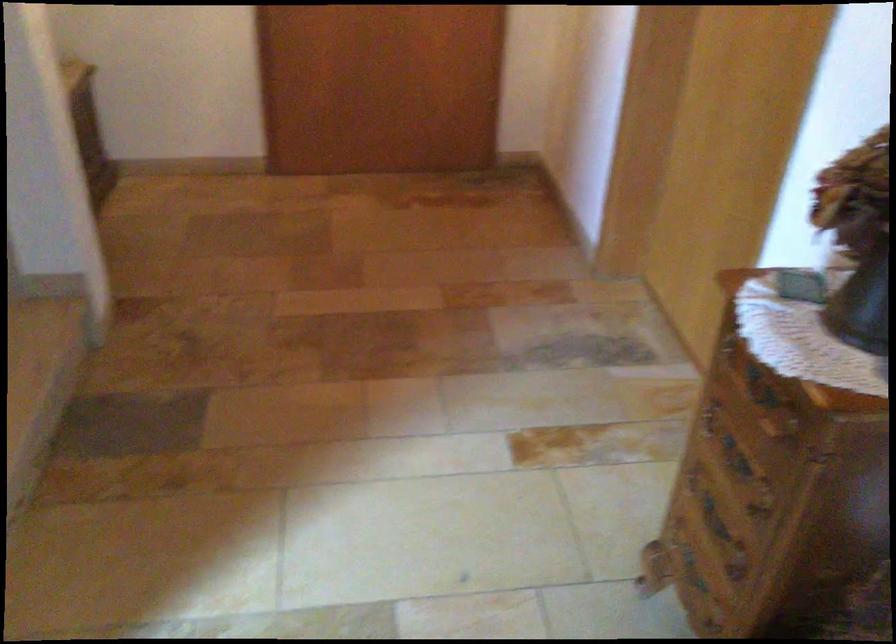
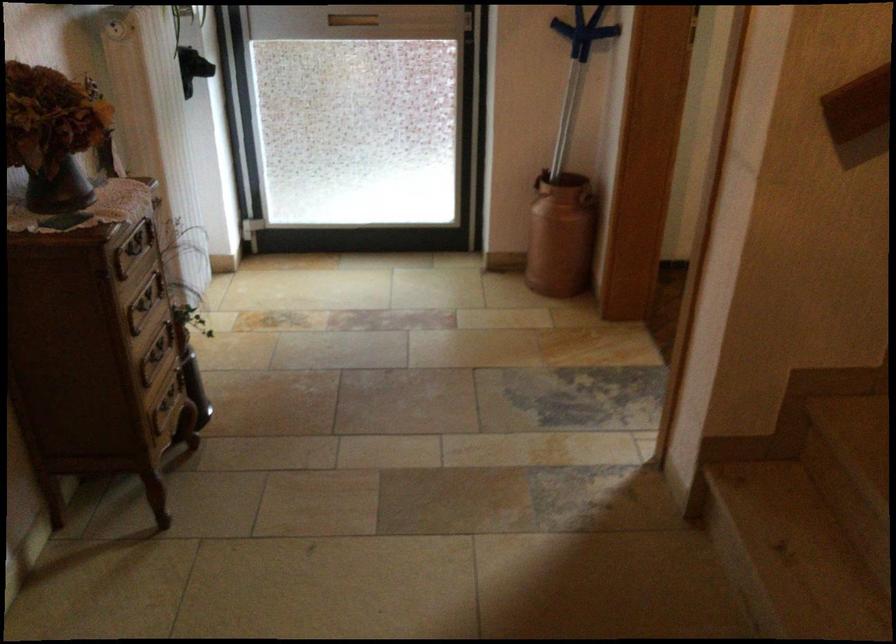
Where in the second image is the point corresponding to the point at 782,395 from the first image?

(133, 248)